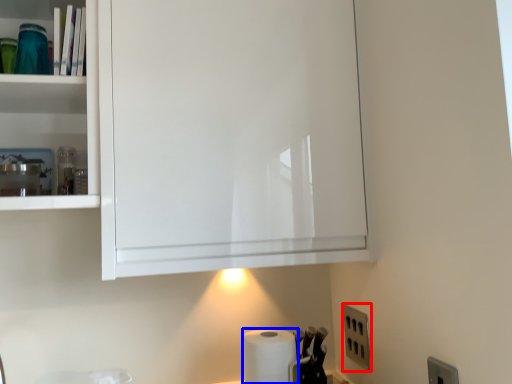
Question: Which of the following is the farthest to the observer, electric outlet (highlighted by a red box) or paper towel (highlighted by a blue box)?

Choices:
 (A) electric outlet
 (B) paper towel

Answer: (A)